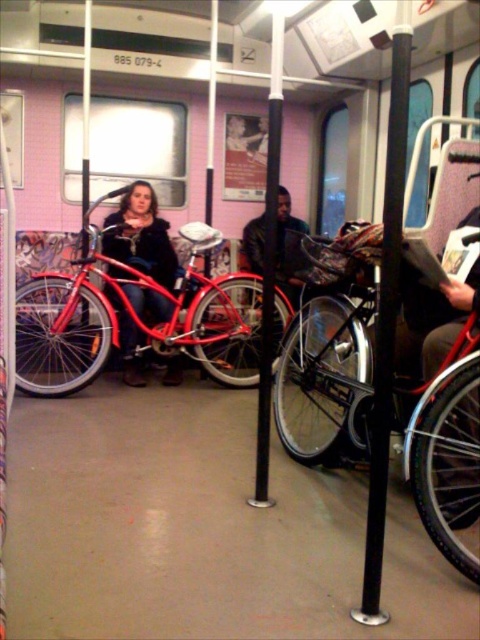
Question: Considering the real-world distances, which object is farthest from the black metal pole at center?

Choices:
 (A) shiny red bicycle at left
 (B) black matte pole at center
 (C) shiny metallic bicycle at center
 (D) matte black jacket at center

Answer: (D)

Question: Estimate the real-world distances between objects in this image. Which object is closer to the matte black jacket at center?

Choices:
 (A) black metal pole at center
 (B) shiny metallic bicycle at center
 (C) black matte pole at center

Answer: (B)

Question: Which of the following is the closest to the observer?

Choices:
 (A) (262, 342)
 (B) (369, 516)
 (C) (259, 323)
 (D) (120, 220)

Answer: (B)

Question: Does shiny metallic bicycle at center have a larger size compared to black matte pole at center?

Choices:
 (A) no
 (B) yes

Answer: (B)

Question: Can you confirm if matte black jacket at center is positioned to the left of black matte pole at center?

Choices:
 (A) no
 (B) yes

Answer: (B)

Question: Does shiny metallic bicycle at center have a lesser width compared to matte black jacket at center?

Choices:
 (A) yes
 (B) no

Answer: (B)